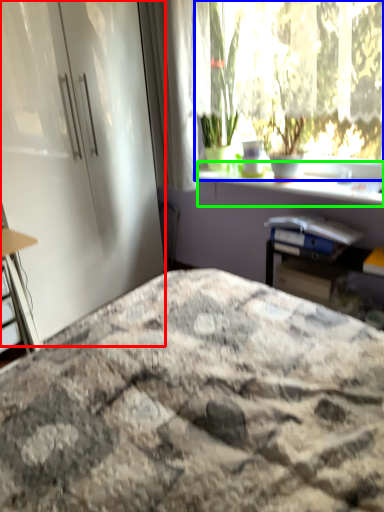
Question: Considering the real-world distances, which object is farthest from screen door (highlighted by a red box)? window (highlighted by a blue box) or window sill (highlighted by a green box)?

Choices:
 (A) window
 (B) window sill

Answer: (A)